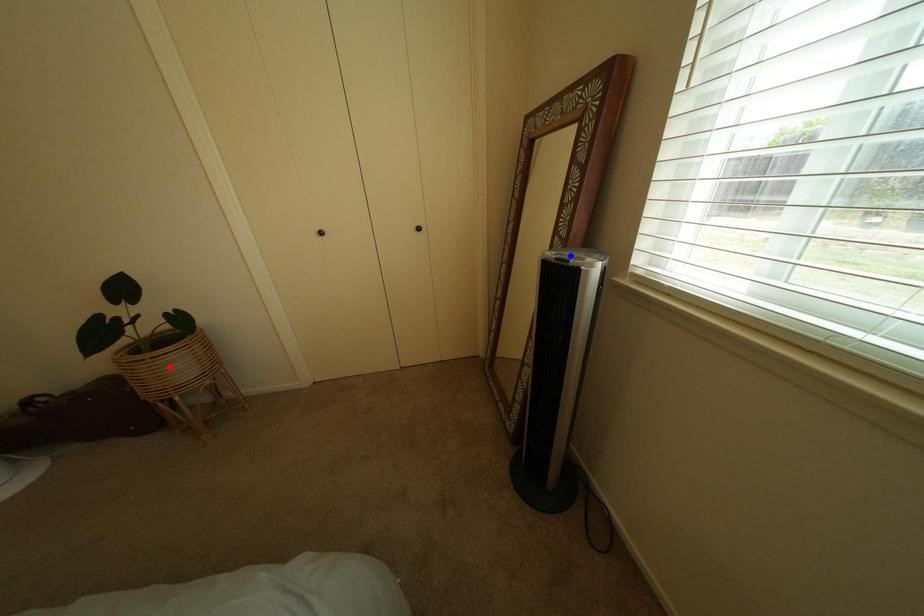
Question: In the image, two points are highlighted. Which point is nearer to the camera? Reply with the corresponding letter.

Choices:
 (A) blue point
 (B) red point

Answer: (A)